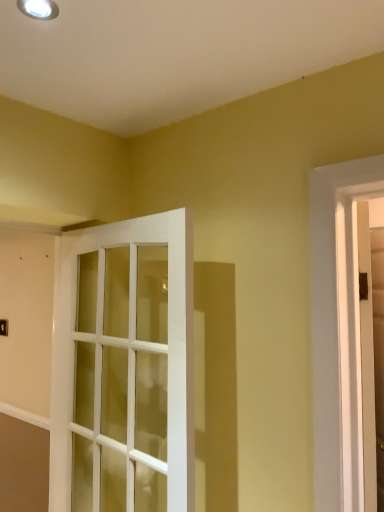
Image resolution: width=384 pixels, height=512 pixels. I want to click on white glass door at center, so click(x=123, y=367).

Describe the element at coordinates (123, 367) in the screenshot. The width and height of the screenshot is (384, 512). I see `white glass door at center` at that location.

You are a GUI agent. You are given a task and a screenshot of the screen. Output one action in this format:
    pyautogui.click(x=<x>, y=<y>)
    Task: Click on the white glass door at center
    This screenshot has height=512, width=384.
    Given the screenshot: What is the action you would take?
    point(123,367)